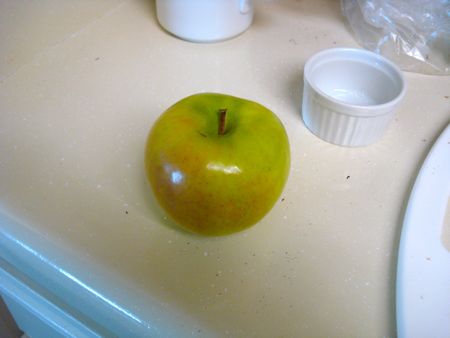
Image resolution: width=450 pixels, height=338 pixels. Identify the location of floor. (6, 330).